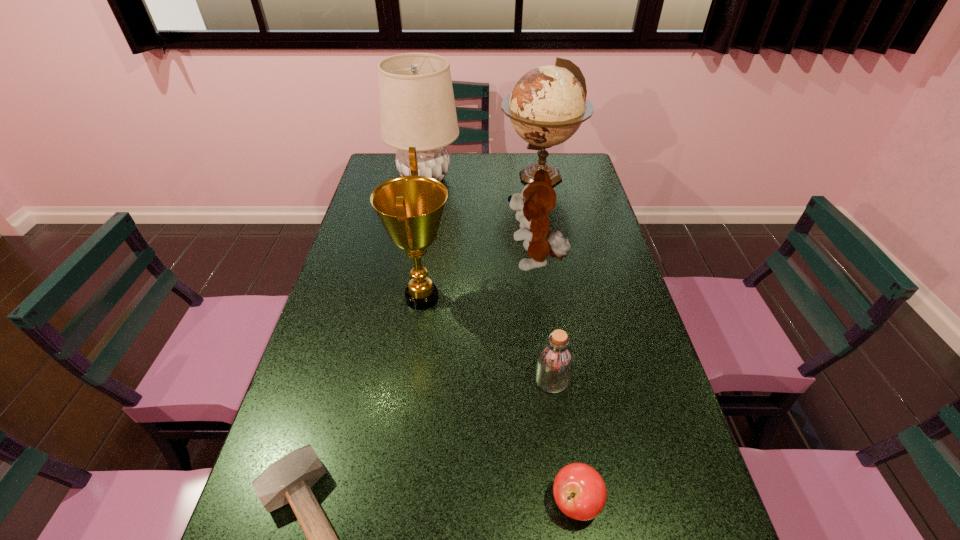
In order to click on globe in this screenshot , I will do `click(548, 104)`.

Where is `lampshade`? This screenshot has height=540, width=960. lampshade is located at coordinates tap(417, 108).

The height and width of the screenshot is (540, 960). In order to click on award in this screenshot , I will do `click(410, 208)`.

You are a GUI agent. You are given a task and a screenshot of the screen. Output one action in this format:
    pyautogui.click(x=<x>, y=<y>)
    Task: Click on the fourth tallest object
    This screenshot has height=540, width=960.
    Given the screenshot: What is the action you would take?
    538,198

At what (x,y) coordinates should I click in order to perform the action: click on the third nearest object. Please return your answer as a coordinate pair (x, y). Looking at the image, I should click on (555, 359).

Where is `the third shortest object`? The width and height of the screenshot is (960, 540). the third shortest object is located at coordinates 555,359.

The width and height of the screenshot is (960, 540). Identify the location of apple. (579, 491).

At what (x,y) coordinates should I click in order to perform the action: click on vacant position located 0.190m on the front of the globe showing Asia. Please return your answer as a coordinate pair (x, y). The width and height of the screenshot is (960, 540). Looking at the image, I should click on (451, 176).

The image size is (960, 540). Find the location of `vacant space situated 0.080m on the front of the globe showing Asia`. vacant space situated 0.080m on the front of the globe showing Asia is located at coordinates (479, 176).

Locate an element on the screen. This screenshot has width=960, height=540. vacant point located on the front of the globe showing Asia is located at coordinates (446, 176).